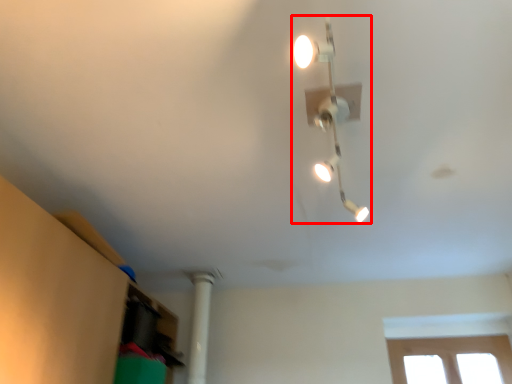
Question: Observing the image, what is the correct spatial positioning of lamp (annotated by the red box) in reference to pillar?

Choices:
 (A) right
 (B) left

Answer: (A)